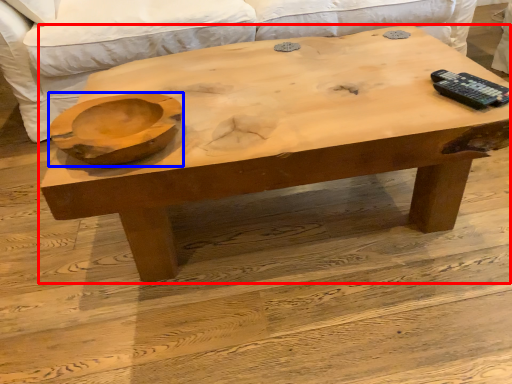
Question: Which point is further to the camera, coffee table (highlighted by a red box) or bowl (highlighted by a blue box)?

Choices:
 (A) coffee table
 (B) bowl

Answer: (A)